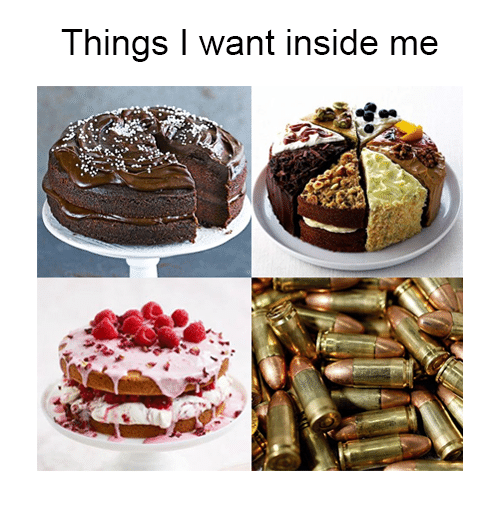
This screenshot has width=500, height=522. I want to click on serving dish, so pyautogui.click(x=143, y=249), pyautogui.click(x=345, y=258), pyautogui.click(x=148, y=449).